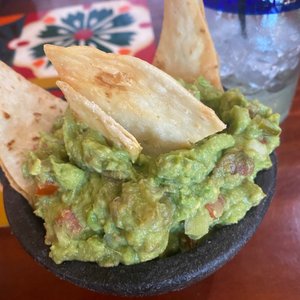
I want to click on glass, so click(254, 26).